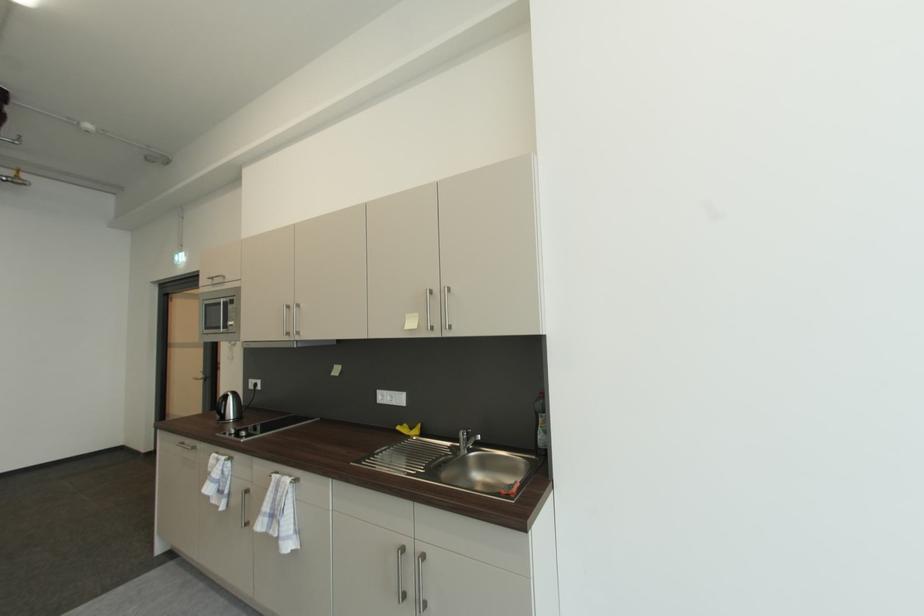
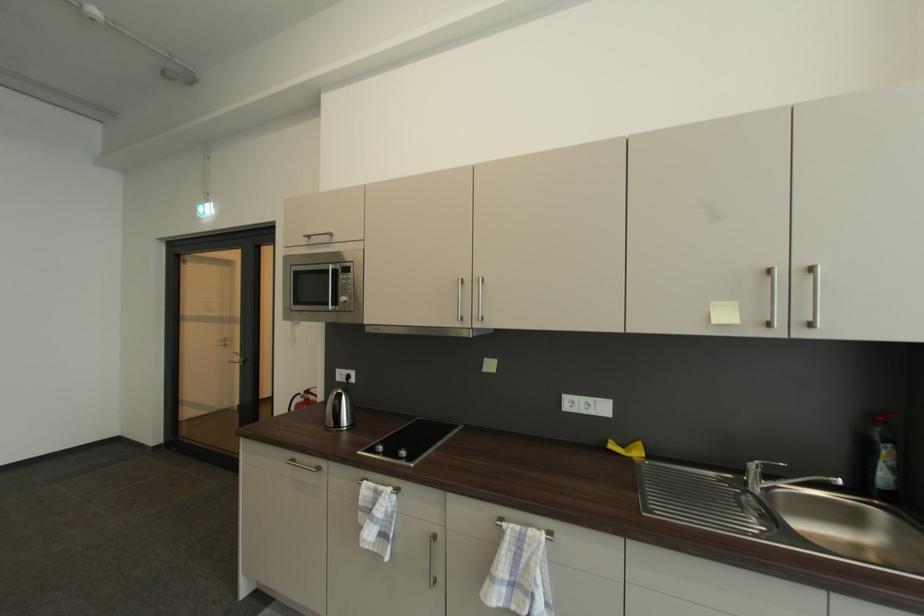
In the second image, find the point that corresponds to pixel 227 402 in the first image.

(344, 403)